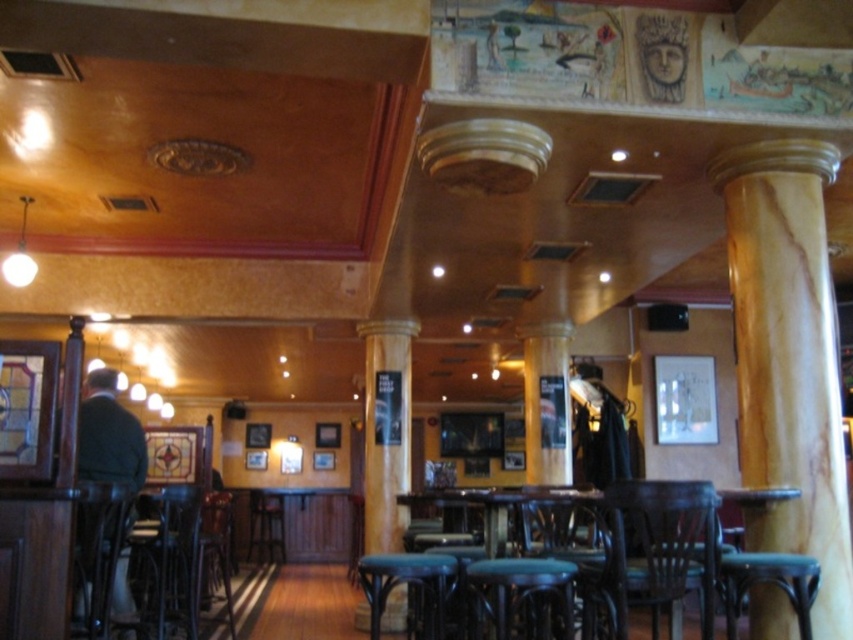
You are a customer sitting on the wooden bar stool at center. You want to move to the dark brown wood bar stool at center. Which direction should you move to reach it?

The dark brown wood bar stool at center is in front of the wooden bar stool at center, so you should move forward to reach it.

You are a person standing in the bar and want to sit down. You see the marble column at right and the wooden textured chair at center. Which object is higher from the floor?

The marble column at right is higher from the floor than the wooden textured chair at center.

In the scene shown: You are a barista preparing to hang a large framed artwork on the wall. You have two options to choose from. The first is the dark green sweater at left, and the second is the wooden bar stool at center. Which of these would require a larger hook to hang due to its size?

The dark green sweater at left requires a larger hook because it is larger in size than the wooden bar stool at center.